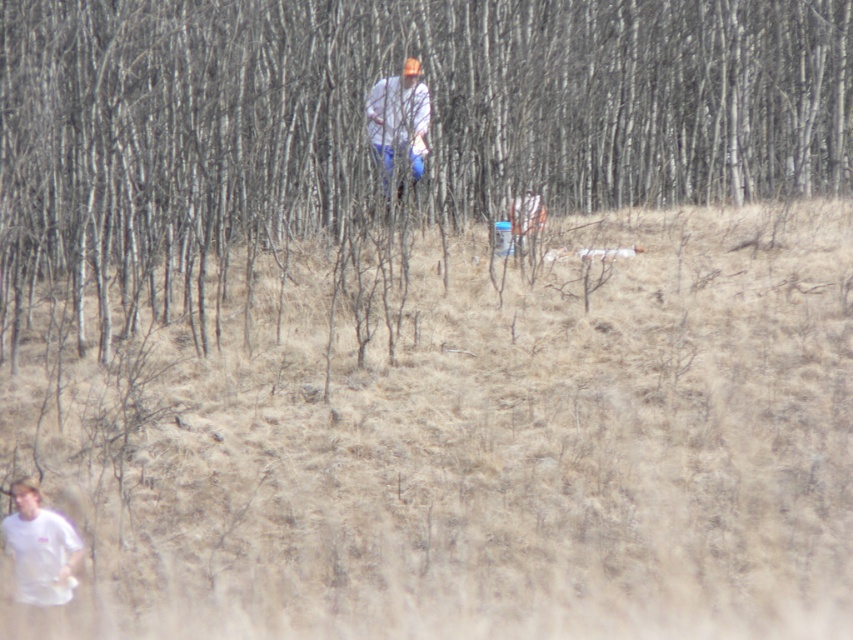
You are standing in the field and want to place a 1.5 meter long ladder between the brown bark tree at center and the white matte shirt at center. Will the ladder fit between them?

The distance between the brown bark tree at center and the white matte shirt at center is 1.82 meters. Since the ladder is 1.5 meters long, it will fit between them with some space to spare.